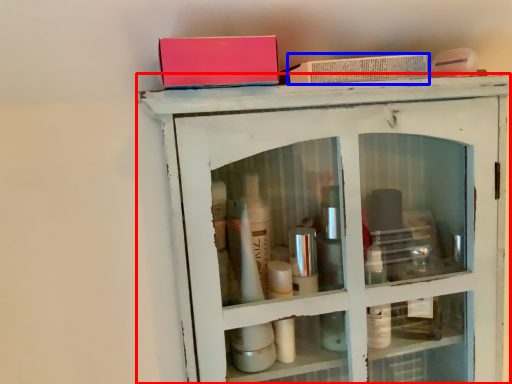
Question: Which object appears closest to the camera in this image, shelf (highlighted by a red box) or book (highlighted by a blue box)?

Choices:
 (A) shelf
 (B) book

Answer: (A)